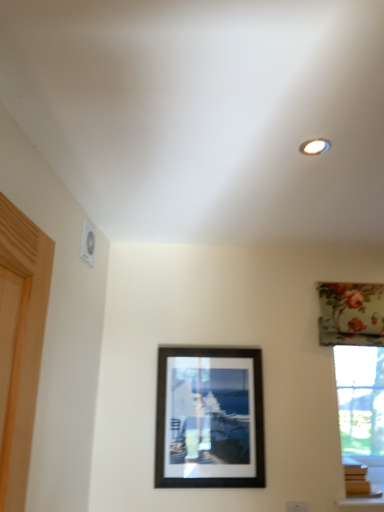
Question: Is floral fabric curtain at upper right wider or thinner than black matte picture frame at center?

Choices:
 (A) thin
 (B) wide

Answer: (B)

Question: From a real-world perspective, is floral fabric curtain at upper right physically located above or below black matte picture frame at center?

Choices:
 (A) above
 (B) below

Answer: (A)

Question: Is point (370, 296) positioned closer to the camera than point (162, 359)?

Choices:
 (A) closer
 (B) farther

Answer: (B)

Question: Is black matte picture frame at center taller or shorter than floral fabric curtain at upper right?

Choices:
 (A) tall
 (B) short

Answer: (A)

Question: In the image, is black matte picture frame at center positioned in front of or behind floral fabric curtain at upper right?

Choices:
 (A) front
 (B) behind

Answer: (A)

Question: Based on their sizes in the image, would you say black matte picture frame at center is bigger or smaller than floral fabric curtain at upper right?

Choices:
 (A) big
 (B) small

Answer: (A)

Question: In terms of width, does black matte picture frame at center look wider or thinner when compared to floral fabric curtain at upper right?

Choices:
 (A) wide
 (B) thin

Answer: (B)